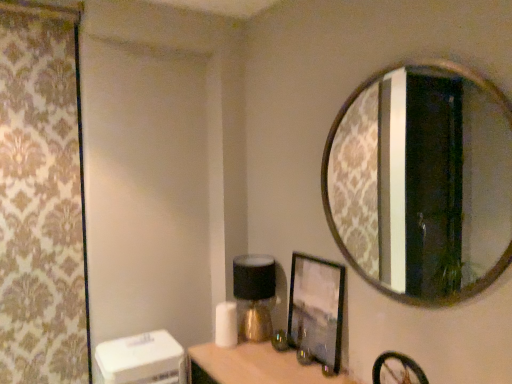
What is the approximate height of matte black picture frame at center?

matte black picture frame at center is 17.71 inches tall.

I want to click on matte black picture frame at center, so click(316, 308).

Is matte black picture frame at center bigger or smaller than gold-framed mirror at upper right?

Considering their sizes, matte black picture frame at center takes up less space than gold-framed mirror at upper right.

Is matte black picture frame at center located outside gold-framed mirror at upper right?

That's correct, matte black picture frame at center is outside of gold-framed mirror at upper right.

From the image's perspective, which is above, matte black picture frame at center or gold-framed mirror at upper right?

gold-framed mirror at upper right, from the image's perspective.

From a real-world perspective, does gold-framed mirror at upper right stand above matte black picture frame at center?

Correct, in the physical world, gold-framed mirror at upper right is higher than matte black picture frame at center.

You are a GUI agent. You are given a task and a screenshot of the screen. Output one action in this format:
    pyautogui.click(x=<x>, y=<y>)
    Task: Click on the mirror on the right of matte black picture frame at center
    This screenshot has width=512, height=384.
    Given the screenshot: What is the action you would take?
    pyautogui.click(x=422, y=182)

Considering the relative sizes of gold-framed mirror at upper right and matte black picture frame at center in the image provided, is gold-framed mirror at upper right taller than matte black picture frame at center?

Indeed, gold-framed mirror at upper right has a greater height compared to matte black picture frame at center.

From the image's perspective, does gold-framed mirror at upper right appear lower than matte black picture frame at center?

No, from the image's perspective, gold-framed mirror at upper right is not beneath matte black picture frame at center.

Does patterned fabric curtain at left have a smaller size compared to gold-framed mirror at upper right?

Actually, patterned fabric curtain at left might be larger than gold-framed mirror at upper right.

Locate an element on the screen. mirror in front of the patterned fabric curtain at left is located at coordinates (422, 182).

Where is `picture frame below the patterned fabric curtain at left (from a real-world perspective)`? The width and height of the screenshot is (512, 384). picture frame below the patterned fabric curtain at left (from a real-world perspective) is located at coordinates (316, 308).

Would you say matte black picture frame at center is a long distance from patterned fabric curtain at left?

Yes, matte black picture frame at center and patterned fabric curtain at left are located far from each other.

Is matte black picture frame at center aimed at patterned fabric curtain at left?

No.

How many degrees apart are the facing directions of matte black picture frame at center and patterned fabric curtain at left?

90.4 degrees.

Between gold-framed mirror at upper right and patterned fabric curtain at left, which one appears on the right side from the viewer's perspective?

From the viewer's perspective, gold-framed mirror at upper right appears more on the right side.

Is gold-framed mirror at upper right in front of or behind patterned fabric curtain at left in the image?

Clearly, gold-framed mirror at upper right is in front of patterned fabric curtain at left.

Can you tell me how much gold-framed mirror at upper right and patterned fabric curtain at left differ in facing direction?

They differ by 91 degrees in their facing directions.

Which object is closer to the camera taking this photo, patterned fabric curtain at left or matte black picture frame at center?

Positioned in front is matte black picture frame at center.

Looking at the image, does patterned fabric curtain at left seem bigger or smaller compared to matte black picture frame at center?

Clearly, patterned fabric curtain at left is larger in size than matte black picture frame at center.

Can you confirm if patterned fabric curtain at left is taller than matte black picture frame at center?

Yes.

Which object is further away from the camera, gold-framed mirror at upper right or matte gold table lamp at center?

matte gold table lamp at center is more distant.

From a real-world perspective, which object stands above the other?

gold-framed mirror at upper right is physically above.

Image resolution: width=512 pixels, height=384 pixels. I want to click on mirror above the matte gold table lamp at center (from the image's perspective), so click(422, 182).

Between gold-framed mirror at upper right and matte gold table lamp at center, which one has smaller size?

With smaller size is matte gold table lamp at center.

At what (x,y) coordinates should I click in order to perform the action: click on mirror that is above the matte black picture frame at center (from a real-world perspective). Please return your answer as a coordinate pair (x, y). This screenshot has width=512, height=384. Looking at the image, I should click on (422, 182).

Where is `picture frame directly beneath the gold-framed mirror at upper right (from a real-world perspective)`? picture frame directly beneath the gold-framed mirror at upper right (from a real-world perspective) is located at coordinates (316, 308).

Estimate the real-world distances between objects in this image. Which object is further from matte black picture frame at center, matte gold table lamp at center or patterned fabric curtain at left?

Among the two, patterned fabric curtain at left is located further to matte black picture frame at center.

From the image, which object appears to be nearer to matte gold table lamp at center, patterned fabric curtain at left or gold-framed mirror at upper right?

patterned fabric curtain at left.

When comparing their distances from matte gold table lamp at center, does matte black picture frame at center or gold-framed mirror at upper right seem further?

gold-framed mirror at upper right lies further to matte gold table lamp at center than the other object.

Looking at the image, which one is located further to matte gold table lamp at center, patterned fabric curtain at left or matte black picture frame at center?

patterned fabric curtain at left is further to matte gold table lamp at center.

Which object lies nearer to the anchor point matte gold table lamp at center, matte black picture frame at center or patterned fabric curtain at left?

matte black picture frame at center.

Looking at the image, which one is located further to gold-framed mirror at upper right, matte gold table lamp at center or patterned fabric curtain at left?

patterned fabric curtain at left lies further to gold-framed mirror at upper right than the other object.

Looking at the image, which one is located further to matte gold table lamp at center, gold-framed mirror at upper right or matte black picture frame at center?

The object further to matte gold table lamp at center is gold-framed mirror at upper right.

Based on their spatial positions, is patterned fabric curtain at left or matte black picture frame at center closer to gold-framed mirror at upper right?

matte black picture frame at center is closer to gold-framed mirror at upper right.

Locate an element on the screen. table lamp located between patterned fabric curtain at left and gold-framed mirror at upper right in the left-right direction is located at coordinates (254, 296).

This screenshot has height=384, width=512. In order to click on picture frame located between gold-framed mirror at upper right and matte gold table lamp at center in the depth direction in this screenshot , I will do `click(316, 308)`.

The image size is (512, 384). Identify the location of table lamp located between patterned fabric curtain at left and matte black picture frame at center in the left-right direction. (254, 296).

You are a GUI agent. You are given a task and a screenshot of the screen. Output one action in this format:
    pyautogui.click(x=<x>, y=<y>)
    Task: Click on the picture frame situated between patterned fabric curtain at left and gold-framed mirror at upper right from left to right
    The height and width of the screenshot is (384, 512).
    Given the screenshot: What is the action you would take?
    pyautogui.click(x=316, y=308)